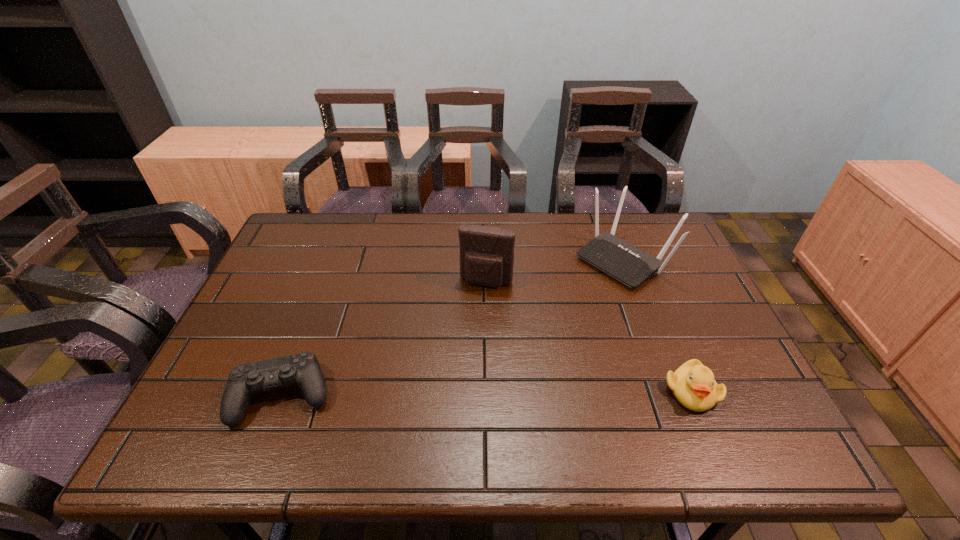
Find the location of a particular element. This screenshot has height=540, width=960. unoccupied position between the duckling and the leftmost object is located at coordinates (488, 393).

The height and width of the screenshot is (540, 960). In order to click on free space between the pouch and the duckling in this screenshot , I will do `click(588, 336)`.

Locate an element on the screen. vacant space that's between the leftmost object and the router is located at coordinates (453, 327).

The image size is (960, 540). I want to click on vacant space that is in between the leftmost object and the third object from right to left, so click(385, 339).

The height and width of the screenshot is (540, 960). In order to click on vacant point located between the control and the duckling in this screenshot , I will do `click(488, 393)`.

Identify the location of free spot between the router and the duckling. The image size is (960, 540). (658, 325).

The height and width of the screenshot is (540, 960). I want to click on object that stands as the second closest to the control, so click(630, 265).

Locate an element on the screen. object that is the third closest to the control is located at coordinates (693, 384).

Locate an element on the screen. free location that satisfies the following two spatial constraints: 1. on the back side of the leftmost object; 2. on the left side of the router is located at coordinates (335, 259).

Locate an element on the screen. This screenshot has width=960, height=540. free space that satisfies the following two spatial constraints: 1. on the back side of the router; 2. on the right side of the pouch is located at coordinates (486, 259).